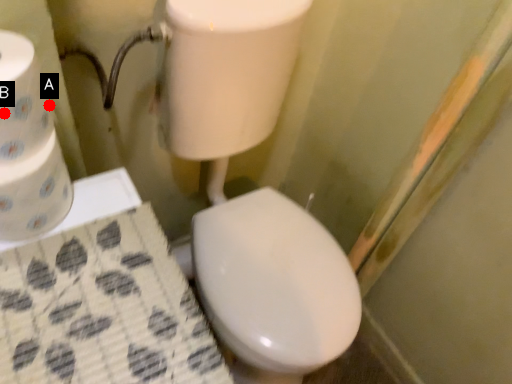
Question: Two points are circled on the image, labeled by A and B beside each circle. Which point appears closest to the camera in this image?

Choices:
 (A) A is closer
 (B) B is closer

Answer: (B)